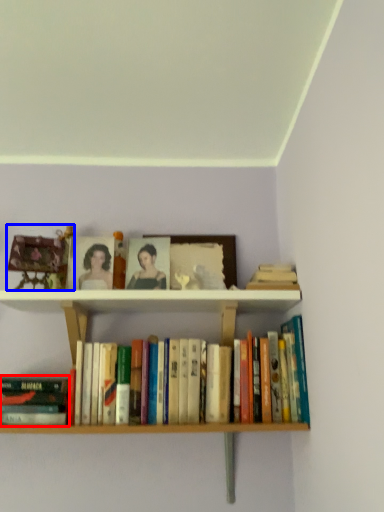
Question: Which object appears farthest to the camera in this image, book (highlighted by a red box) or toy (highlighted by a blue box)?

Choices:
 (A) book
 (B) toy

Answer: (B)